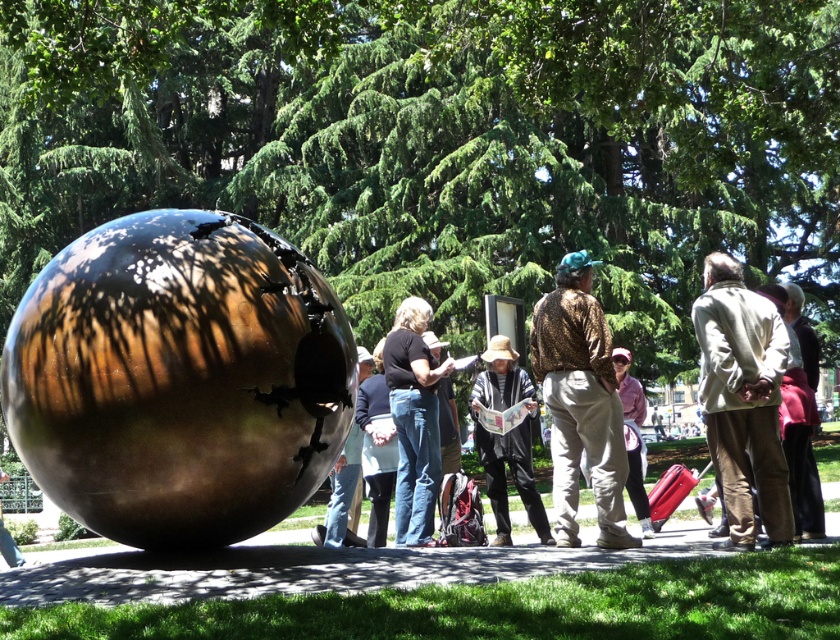
You are a photographer trying to capture a clear shot of the leopard print shirt at center without the shiny metallic sphere at center blocking it. Based on the scene description, is this possible?

The shiny metallic sphere at center might be wider than leopard print shirt at center, so there is a possibility that the sphere could block the view of the shirt depending on their exact positions and angles. To ensure a clear shot, you might need to adjust your position or angle to avoid the sphere obstructing the shirt.

You are a photographer trying to capture the group of people in the park scene. You want to ensure that both the light beige jacket at right and the matte black shirt at center are visible in your shot. Based on their positions, which object should you position closer to the left side of your camera frame?

The matte black shirt at center should be positioned closer to the left side of your camera frame because the light beige jacket at right is to the right of it.